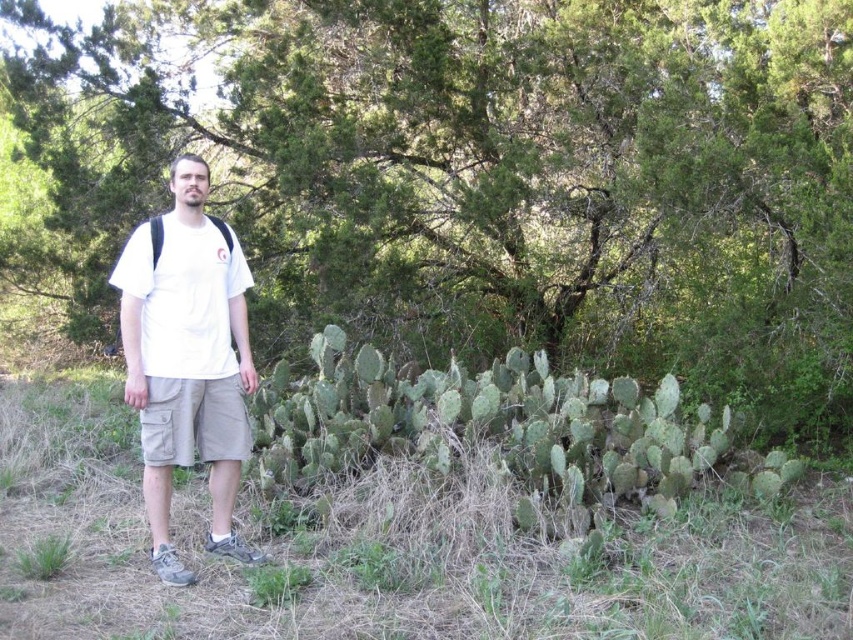
Question: Can you confirm if green leafy bush at center is smaller than white cotton t-shirt at center?

Choices:
 (A) yes
 (B) no

Answer: (B)

Question: Which point is closer to the camera?

Choices:
 (A) (523, 234)
 (B) (149, 308)

Answer: (B)

Question: Can you confirm if green leafy bush at center is wider than white cotton t-shirt at center?

Choices:
 (A) no
 (B) yes

Answer: (B)

Question: Among these objects, which one is farthest from the camera?

Choices:
 (A) white cotton t-shirt at center
 (B) green leafy bush at center

Answer: (B)

Question: Does green leafy bush at center have a larger size compared to white cotton t-shirt at center?

Choices:
 (A) no
 (B) yes

Answer: (B)